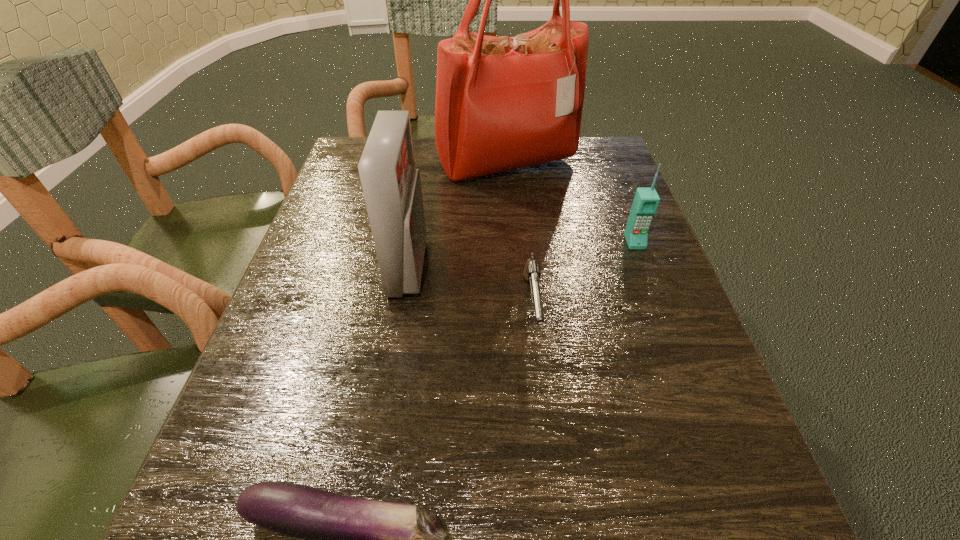
Where is `the tallest object`? This screenshot has width=960, height=540. the tallest object is located at coordinates (502, 103).

This screenshot has width=960, height=540. Find the location of `the farthest object`. the farthest object is located at coordinates click(x=502, y=103).

In order to click on the first-aid kit in this screenshot , I will do tap(391, 186).

At what (x,y) coordinates should I click in order to perform the action: click on cellular telephone. Please return your answer as a coordinate pair (x, y). The height and width of the screenshot is (540, 960). Looking at the image, I should click on (646, 200).

Identify the location of the rightmost object. (646, 200).

In order to click on the second shortest object in this screenshot , I will do `click(531, 273)`.

Find the location of a particular element. vacant area situated 0.090m on the front-facing side of the tallest object is located at coordinates (511, 216).

Identify the location of vacant space situated 0.180m on the front-facing side of the fourth shortest object. Image resolution: width=960 pixels, height=540 pixels. (517, 268).

Locate an element on the screen. This screenshot has height=540, width=960. vacant space located 0.120m on the keypad of the cellular telephone is located at coordinates (655, 294).

What are the coordinates of `free spot located 0.180m aiming along the barrel of the fourth tallest object` in the screenshot? It's located at (549, 462).